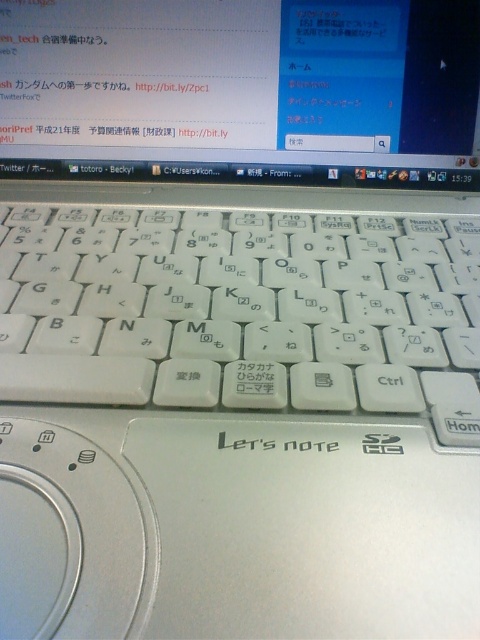
You are setting up a desk for ergonomic purposes and need to adjust the height of the white plastic keyboard at center and the matte white monitor at center. Based on their current positions, which object should you raise to ensure proper ergonomic alignment?

The white plastic keyboard at center has a greater height compared to the matte white monitor at center, so you should raise the matte white monitor at center to align it properly with the keyboard.

You are positioning a mouse on the desk next to the white plastic keyboard at center. Where should you place the mouse relative to the keyboard?

The white plastic keyboard at center is located at point 2D coordinates of (242, 310). Since the mouse is typically placed to the right or left of the keyboard, you should position it either to the right or left side of the white plastic keyboard at center based on your hand preference.

You are holding a camera 12 inches away from the white plastic keyboard at center. Can you move closer to capture a clearer photo?

The white plastic keyboard at center is 13.48 inches from the camera. Since you are currently holding the camera 12 inches away, you are already closer than the required distance. Moving closer might not be necessary unless you want an even closer shot.